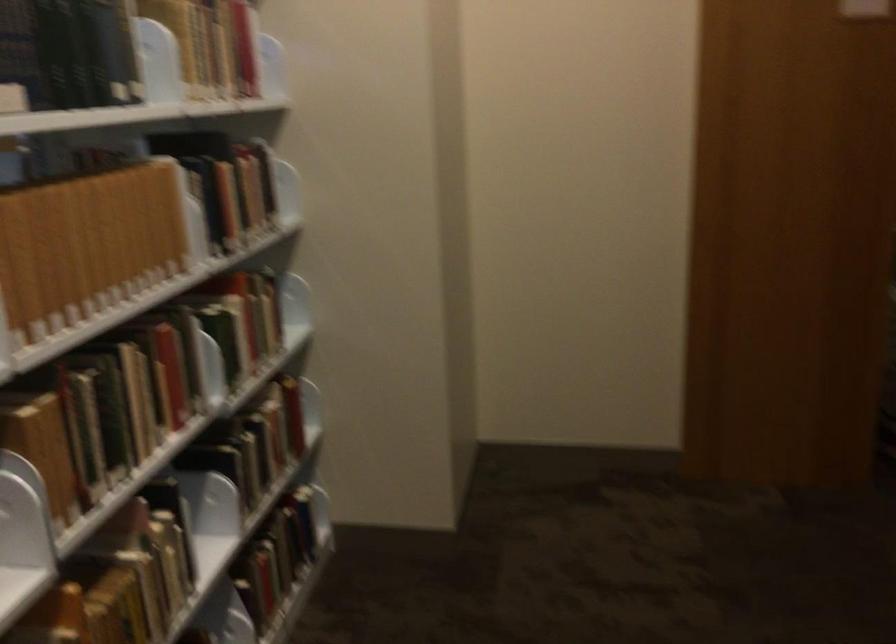
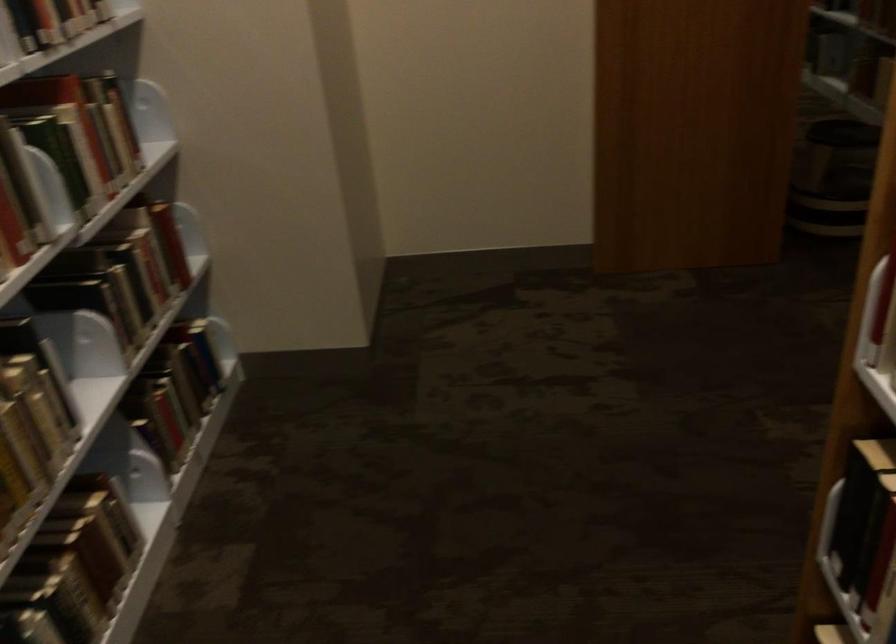
The point at (228, 232) is marked in the first image. Where is the corresponding point in the second image?

(46, 24)